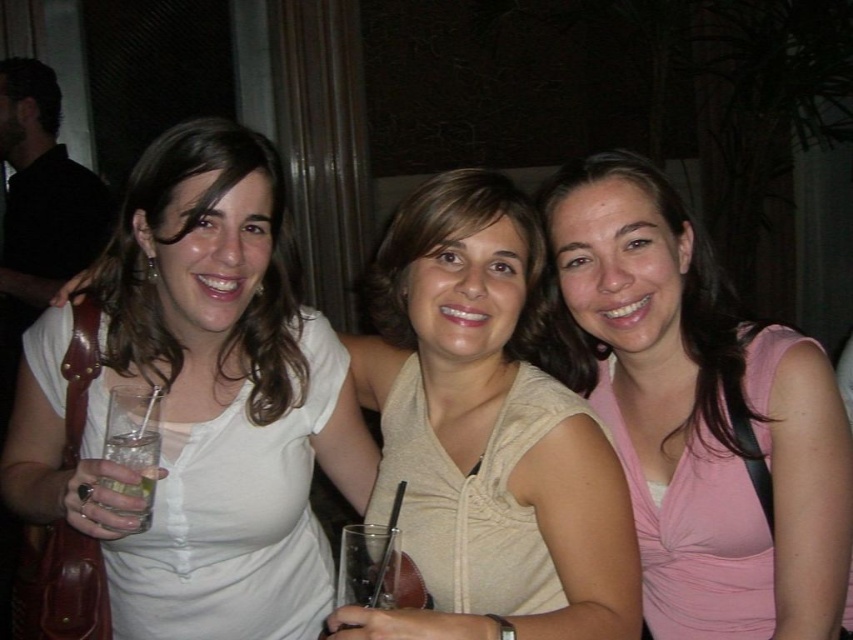
Question: Which of the following is the farthest from the observer?

Choices:
 (A) beige fabric blouse at center
 (B) pink satin tank top at center
 (C) white matte shirt at center
 (D) clear glass at left

Answer: (B)

Question: Can you confirm if white matte shirt at center is positioned below pink satin tank top at center?

Choices:
 (A) yes
 (B) no

Answer: (B)

Question: Which object appears farthest from the camera in this image?

Choices:
 (A) clear glass at left
 (B) white matte shirt at center

Answer: (A)

Question: Which object is farther from the camera taking this photo?

Choices:
 (A) white matte shirt at center
 (B) beige fabric blouse at center
 (C) clear glass at left

Answer: (C)

Question: Does beige fabric blouse at center appear on the right side of clear glass at left?

Choices:
 (A) yes
 (B) no

Answer: (A)

Question: Is white matte shirt at center thinner than beige fabric blouse at center?

Choices:
 (A) yes
 (B) no

Answer: (B)